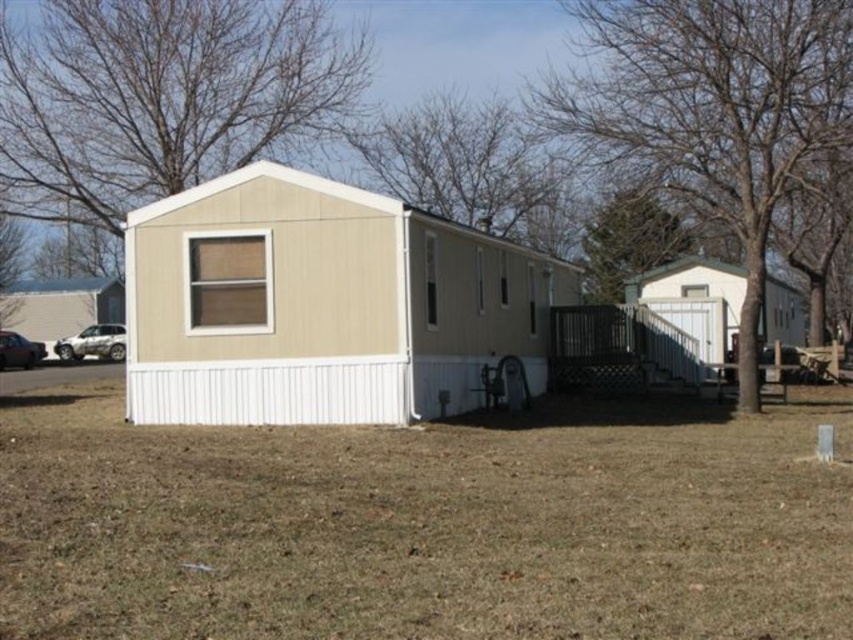
Identify the location of brown grass at lower center. Image resolution: width=853 pixels, height=640 pixels. (425, 525).

Does brown grass at lower center come behind silver metallic suv at left?

That is False.

Locate an element on the screen. The image size is (853, 640). brown grass at lower center is located at coordinates (425, 525).

Is beige siding mobile home at center to the right of beige wood tree at upper left from the viewer's perspective?

Yes, beige siding mobile home at center is to the right of beige wood tree at upper left.

Who is positioned more to the right, beige siding mobile home at center or beige wood tree at upper left?

beige siding mobile home at center is more to the right.

Who is more forward, (352, 193) or (151, 97)?

Positioned in front is point (352, 193).

The height and width of the screenshot is (640, 853). I want to click on beige siding mobile home at center, so click(321, 305).

Can you confirm if brown leafless tree at center is smaller than black matte car at left?

Incorrect, brown leafless tree at center is not smaller in size than black matte car at left.

Does brown leafless tree at center appear over black matte car at left?

Yes.

The image size is (853, 640). What do you see at coordinates (714, 109) in the screenshot?
I see `brown leafless tree at center` at bounding box center [714, 109].

Locate an element on the screen. This screenshot has width=853, height=640. brown leafless tree at center is located at coordinates (714, 109).